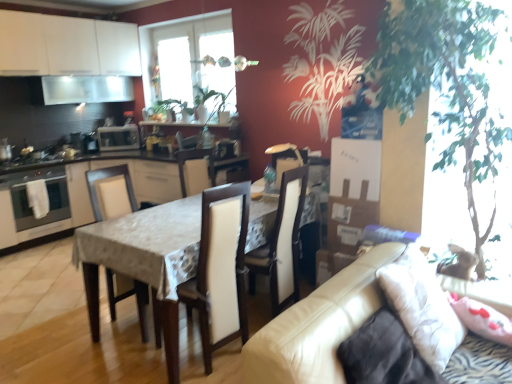
Question: Considering the relative positions of transparent glass window screen at upper center and white glossy cabinets at center, positioned as the 2th cabinetry in top-to-bottom order, in the image provided, is transparent glass window screen at upper center to the right of white glossy cabinets at center, positioned as the 2th cabinetry in top-to-bottom order, from the viewer's perspective?

Choices:
 (A) no
 (B) yes

Answer: (B)

Question: Does transparent glass window screen at upper center appear on the left side of white glossy cabinets at center, positioned as the 2th cabinetry in top-to-bottom order?

Choices:
 (A) yes
 (B) no

Answer: (B)

Question: Does transparent glass window screen at upper center have a lesser width compared to white glossy cabinets at center, the 1th cabinetry ordered from the bottom?

Choices:
 (A) yes
 (B) no

Answer: (A)

Question: Is transparent glass window screen at upper center taller than white glossy cabinets at center, positioned as the 2th cabinetry in top-to-bottom order?

Choices:
 (A) no
 (B) yes

Answer: (B)

Question: Can you confirm if transparent glass window screen at upper center is smaller than white glossy cabinets at center, the 1th cabinetry ordered from the bottom?

Choices:
 (A) no
 (B) yes

Answer: (B)

Question: From the image's perspective, would you say transparent glass window screen at upper center is shown under white glossy cabinets at center, positioned as the 2th cabinetry in top-to-bottom order?

Choices:
 (A) yes
 (B) no

Answer: (B)

Question: From the image's perspective, is white glossy cabinets at center, the 1th cabinetry ordered from the bottom, on stainless steel oven at left?

Choices:
 (A) yes
 (B) no

Answer: (B)

Question: From a real-world perspective, is white glossy cabinets at center, positioned as the 2th cabinetry in top-to-bottom order, physically above stainless steel oven at left?

Choices:
 (A) no
 (B) yes

Answer: (A)

Question: Can you confirm if white glossy cabinets at center, the 1th cabinetry ordered from the bottom, is taller than stainless steel oven at left?

Choices:
 (A) yes
 (B) no

Answer: (A)

Question: Considering the relative sizes of white glossy cabinets at center, the 1th cabinetry ordered from the bottom, and stainless steel oven at left in the image provided, is white glossy cabinets at center, the 1th cabinetry ordered from the bottom, shorter than stainless steel oven at left?

Choices:
 (A) yes
 (B) no

Answer: (B)

Question: Can you confirm if white glossy cabinets at center, positioned as the 2th cabinetry in top-to-bottom order, is smaller than stainless steel oven at left?

Choices:
 (A) yes
 (B) no

Answer: (B)

Question: From the image's perspective, is white leather chair at center, the 1th chair viewed from the right, on top of satin silver oven at left?

Choices:
 (A) no
 (B) yes

Answer: (A)